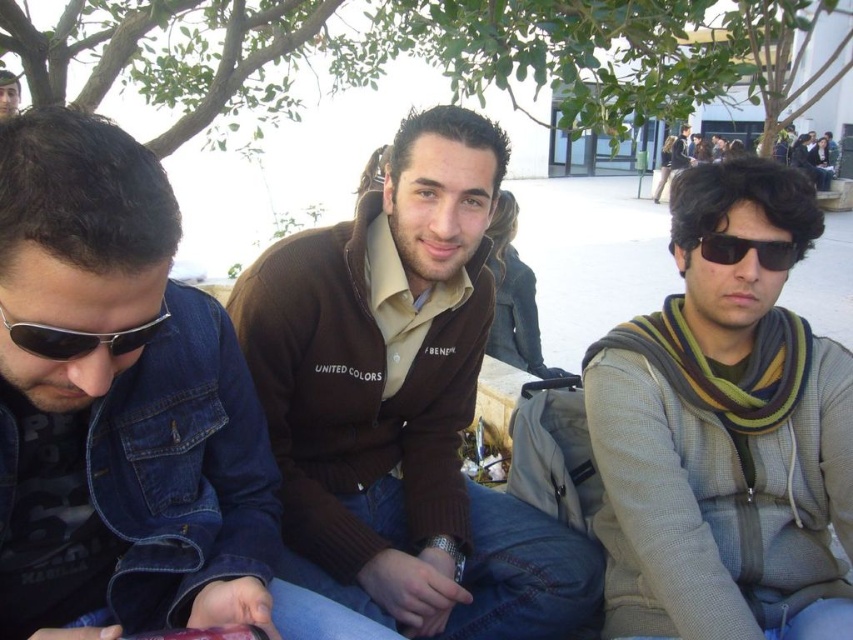
What is the 2D coordinate of the striped scarf at right in the image?

The striped scarf at right is located at the 2D coordinate point of (724, 433).

You are a photographer trying to capture a candid shot of the two people wearing sunglasses in the scene. Since you want to frame them both in the shot, which side should you position yourself relative to the sunglasses at left and black plastic sunglasses at right?

You should position yourself to the left side of the sunglasses at left and black plastic sunglasses at right so that both can be framed in the shot.